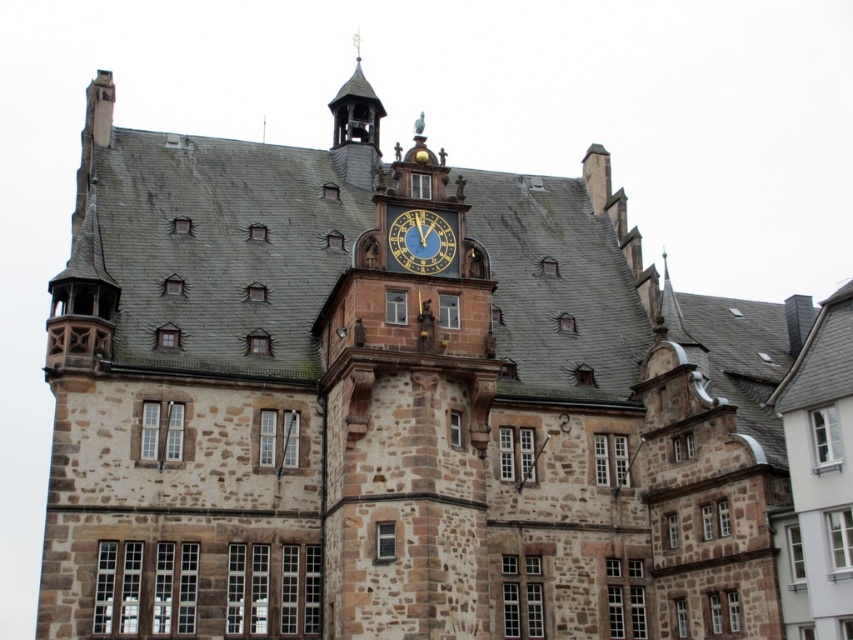
You are an architect examining the historic building. You notice the polished brass bell tower at upper center and the blue painted metal clock at center. Which object would cast a larger shadow during midday when the sun is directly overhead?

The polished brass bell tower at upper center is larger in size than the blue painted metal clock at center, so it would cast a larger shadow during midday when the sun is directly overhead.

You are an architect planning to install a new decorative element on the historic building. You have two options to choose from based on their sizes. The first option is the polished brass bell tower at upper center, and the second is the blue painted metal clock at center. Which of these two objects is taller?

The polished brass bell tower at upper center is taller than the blue painted metal clock at center according to the description provided.

Looking at this image, you are standing in front of the historic building and want to locate both the polished brass bell tower at upper center and the blue painted metal clock at center. Which one is positioned to the left of the other?

The polished brass bell tower at upper center is to the left of the blue painted metal clock at center.